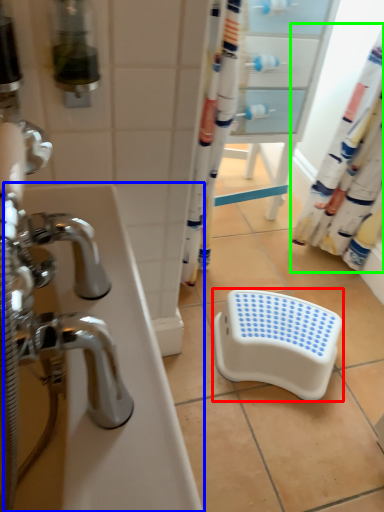
Question: Which object is the farthest from step stool (highlighted by a red box)? Choose among these: bath (highlighted by a blue box) or shower curtain (highlighted by a green box).

Choices:
 (A) bath
 (B) shower curtain

Answer: (A)